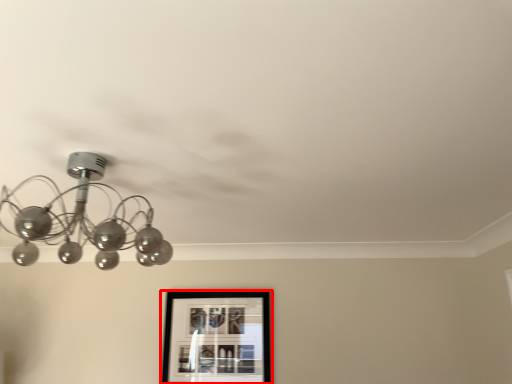
Question: Considering the relative positions of picture frame (annotated by the red box) and lamp in the image provided, where is picture frame (annotated by the red box) located with respect to the staircase?

Choices:
 (A) left
 (B) right

Answer: (B)